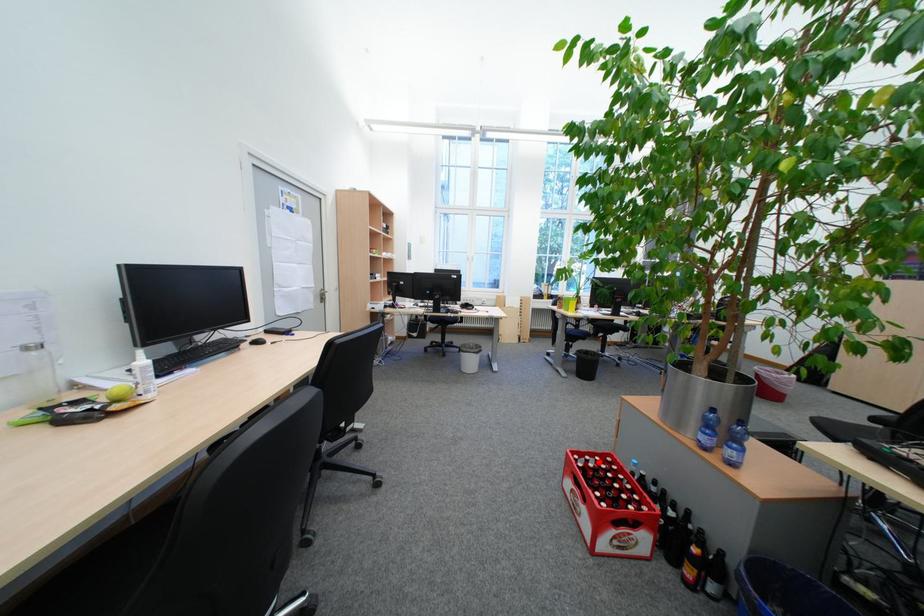
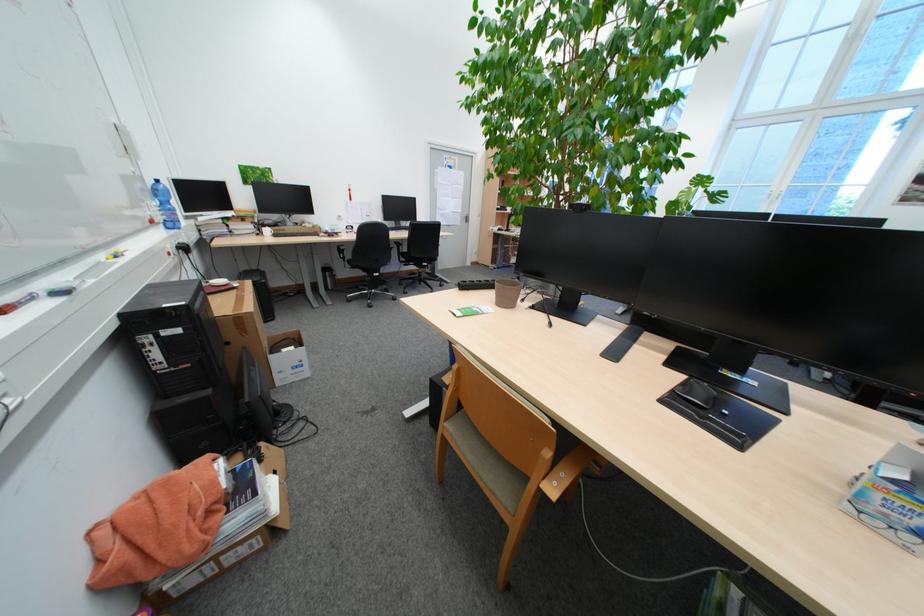
Question: I am providing you with two images of the same scene from different viewpoints. A red point is marked on the first image. Can you still see the location of the red point in image 2?

Choices:
 (A) Yes
 (B) No

Answer: (B)